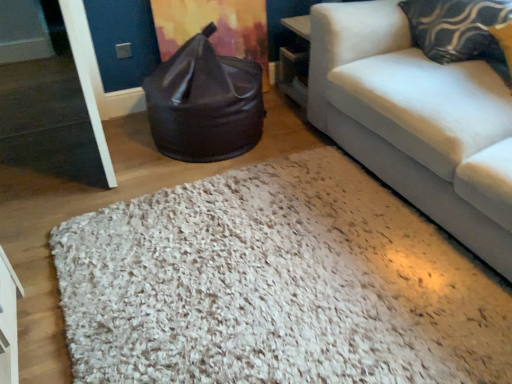
Question: Is patterned fabric pillow at upper right not inside white shaggy rug at center?

Choices:
 (A) yes
 (B) no

Answer: (A)

Question: From the image's perspective, does patterned fabric pillow at upper right appear lower than white shaggy rug at center?

Choices:
 (A) no
 (B) yes

Answer: (A)

Question: Is patterned fabric pillow at upper right at the right side of white shaggy rug at center?

Choices:
 (A) yes
 (B) no

Answer: (A)

Question: Considering the relative sizes of patterned fabric pillow at upper right and white shaggy rug at center in the image provided, is patterned fabric pillow at upper right wider than white shaggy rug at center?

Choices:
 (A) yes
 (B) no

Answer: (B)

Question: Are patterned fabric pillow at upper right and white shaggy rug at center making contact?

Choices:
 (A) yes
 (B) no

Answer: (B)

Question: Is patterned fabric pillow at upper right further to camera compared to white shaggy rug at center?

Choices:
 (A) no
 (B) yes

Answer: (B)

Question: Is white shaggy rug at center surrounded by black leather bean bag at center?

Choices:
 (A) yes
 (B) no

Answer: (B)

Question: Can you confirm if black leather bean bag at center is positioned to the right of white shaggy rug at center?

Choices:
 (A) no
 (B) yes

Answer: (A)

Question: Is black leather bean bag at center positioned in front of white shaggy rug at center?

Choices:
 (A) yes
 (B) no

Answer: (B)

Question: From the image's perspective, is black leather bean bag at center on white shaggy rug at center?

Choices:
 (A) no
 (B) yes

Answer: (B)

Question: Could you tell me if black leather bean bag at center is facing white shaggy rug at center?

Choices:
 (A) yes
 (B) no

Answer: (A)

Question: Considering the relative sizes of black leather bean bag at center and white shaggy rug at center in the image provided, is black leather bean bag at center shorter than white shaggy rug at center?

Choices:
 (A) no
 (B) yes

Answer: (A)

Question: Considering the relative sizes of black leather bean bag at center and patterned fabric pillow at upper right in the image provided, is black leather bean bag at center smaller than patterned fabric pillow at upper right?

Choices:
 (A) no
 (B) yes

Answer: (A)